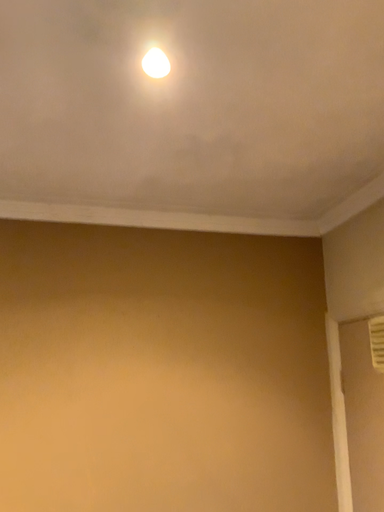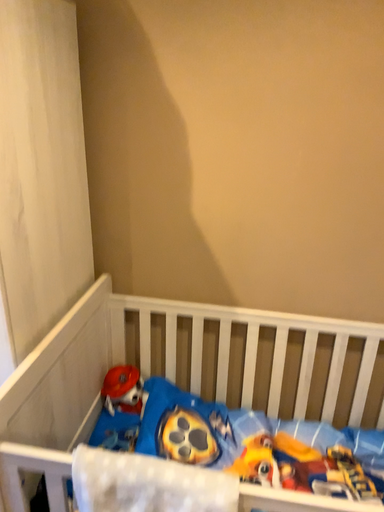
Question: Which way did the camera rotate in the video?

Choices:
 (A) rotated left
 (B) rotated right

Answer: (A)